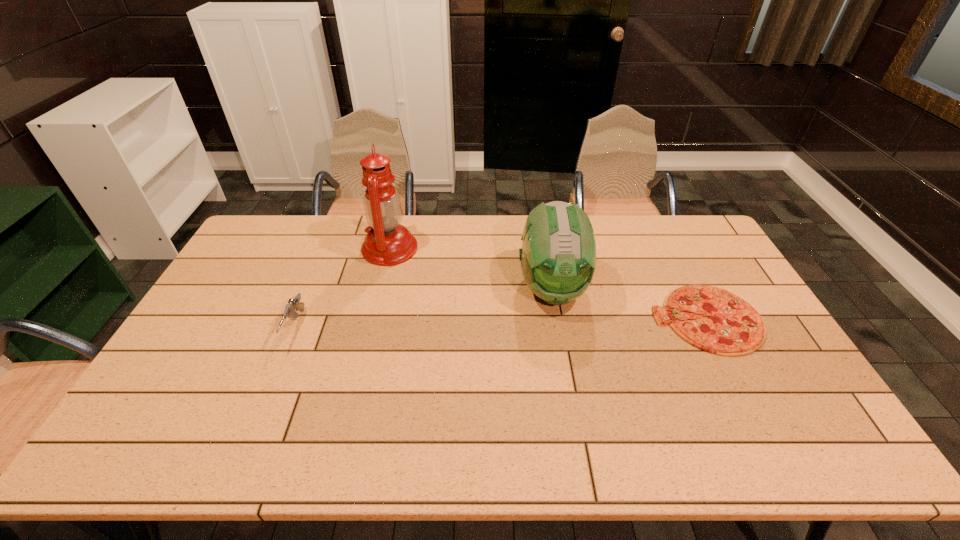
In the image, there is a desktop. Identify the location of free space at the far left corner. The width and height of the screenshot is (960, 540). (277, 251).

At what (x,y) coordinates should I click in order to perform the action: click on vacant space at the far right corner. Please return your answer as a coordinate pair (x, y). Looking at the image, I should click on (690, 241).

You are a GUI agent. You are given a task and a screenshot of the screen. Output one action in this format:
    pyautogui.click(x=<x>, y=<y>)
    Task: Click on the unoccupied area between the gun and the farthest object
    The image size is (960, 540).
    Given the screenshot: What is the action you would take?
    pyautogui.click(x=432, y=279)

The height and width of the screenshot is (540, 960). I want to click on blank region between the second object from left to right and the farthest object, so click(479, 238).

The image size is (960, 540). In order to click on free spot between the oil lamp and the third shortest object in this screenshot , I will do `click(479, 238)`.

The height and width of the screenshot is (540, 960). In order to click on free space between the fourth shortest object and the shortest object in this screenshot , I will do `click(630, 303)`.

At what (x,y) coordinates should I click in order to perform the action: click on free space between the oil lamp and the farthest object. Please return your answer as a coordinate pair (x, y). Looking at the image, I should click on (479, 238).

The width and height of the screenshot is (960, 540). What are the coordinates of `empty space that is in between the fourth shortest object and the pizza` in the screenshot? It's located at (630, 303).

The width and height of the screenshot is (960, 540). What are the coordinates of `unoccupied area between the tallest object and the padlock` in the screenshot? It's located at (479, 238).

The image size is (960, 540). Find the location of `blank region between the gun and the football helmet`. blank region between the gun and the football helmet is located at coordinates (424, 308).